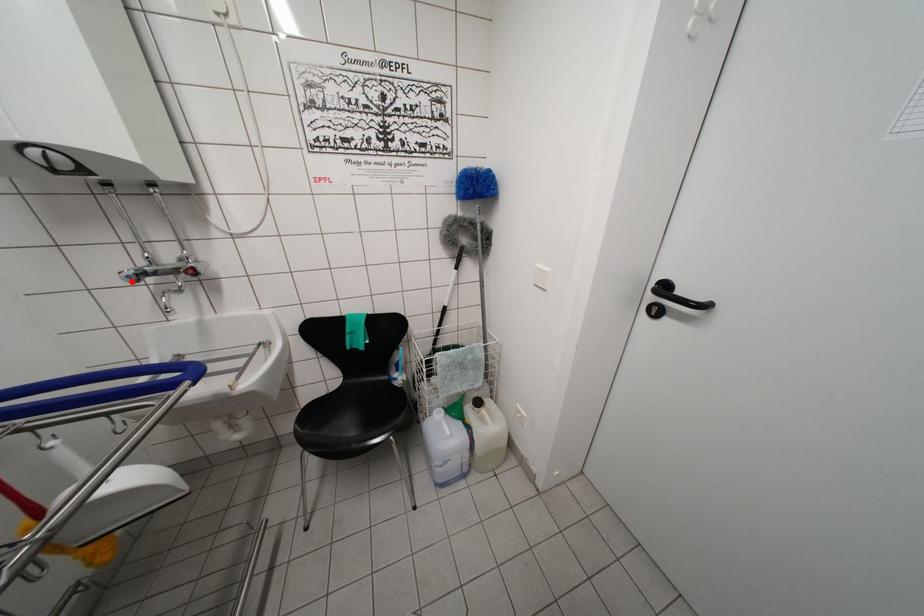
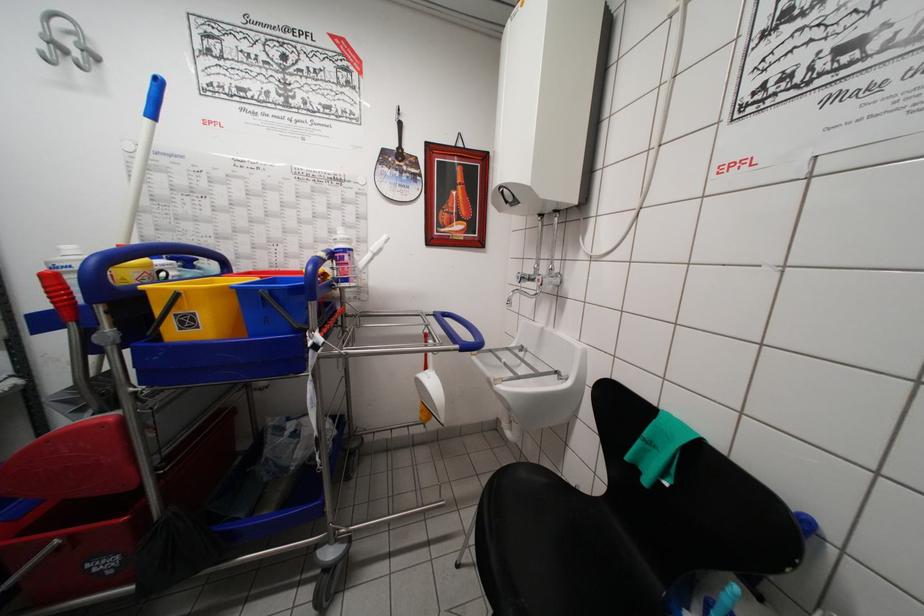
Where in the second image is the point corresponding to the highlighted location from the first image?

(521, 282)